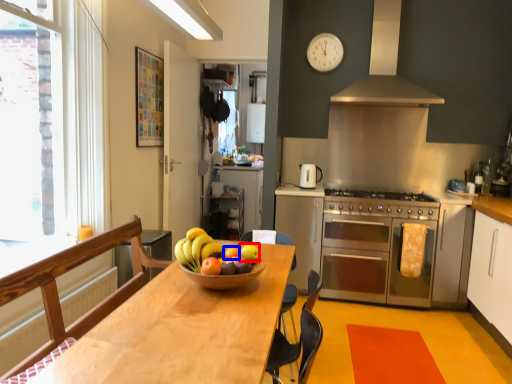
Question: Which point is closer to the camera, apple (highlighted by a red box) or orange (highlighted by a blue box)?

Choices:
 (A) apple
 (B) orange

Answer: (A)